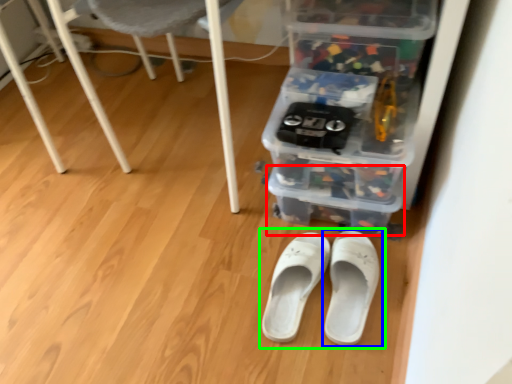
Question: Which object is positioned closest to storage box (highlighted by a red box)? Select from footwear (highlighted by a blue box) and footwear (highlighted by a green box).

Choices:
 (A) footwear
 (B) footwear

Answer: (A)